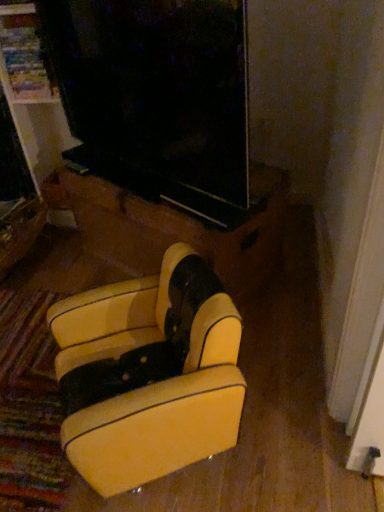
Question: Considering the relative sizes of yellow leather armchair at lower center, the 1th furniture viewed from the front, and wooden drawer at lower left in the image provided, is yellow leather armchair at lower center, the 1th furniture viewed from the front, taller than wooden drawer at lower left?

Choices:
 (A) yes
 (B) no

Answer: (A)

Question: Is yellow leather armchair at lower center, which ranks as the second furniture in back-to-front order, further to camera compared to wooden drawer at lower left?

Choices:
 (A) yes
 (B) no

Answer: (B)

Question: From the image's perspective, would you say yellow leather armchair at lower center, the 1th furniture viewed from the front, is shown under wooden drawer at lower left?

Choices:
 (A) no
 (B) yes

Answer: (B)

Question: Can you confirm if yellow leather armchair at lower center, the 1th furniture viewed from the front, is shorter than wooden drawer at lower left?

Choices:
 (A) yes
 (B) no

Answer: (B)

Question: From the image's perspective, does yellow leather armchair at lower center, the 1th furniture viewed from the front, appear higher than wooden drawer at lower left?

Choices:
 (A) yes
 (B) no

Answer: (B)

Question: From the image's perspective, is yellow leather armchair at lower center, the 1th furniture viewed from the front, positioned above or below leather armchair at center, which is the second furniture from front to back?

Choices:
 (A) above
 (B) below

Answer: (B)

Question: In terms of width, does yellow leather armchair at lower center, which ranks as the second furniture in back-to-front order, look wider or thinner when compared to leather armchair at center, which is the second furniture from front to back?

Choices:
 (A) thin
 (B) wide

Answer: (A)

Question: From a real-world perspective, is yellow leather armchair at lower center, which ranks as the second furniture in back-to-front order, above or below leather armchair at center, which is the first furniture in back-to-front order?

Choices:
 (A) above
 (B) below

Answer: (A)

Question: Is yellow leather armchair at lower center, which ranks as the second furniture in back-to-front order, inside or outside of leather armchair at center, which is the first furniture in back-to-front order?

Choices:
 (A) inside
 (B) outside

Answer: (B)

Question: From a real-world perspective, is leather armchair at center, which is the second furniture from front to back, positioned above or below yellow leather armchair at lower center, the 1th furniture viewed from the front?

Choices:
 (A) above
 (B) below

Answer: (B)

Question: Is leather armchair at center, which is the second furniture from front to back, in front of or behind yellow leather armchair at lower center, the 1th furniture viewed from the front, in the image?

Choices:
 (A) front
 (B) behind

Answer: (B)

Question: Is leather armchair at center, which is the second furniture from front to back, bigger or smaller than yellow leather armchair at lower center, which ranks as the second furniture in back-to-front order?

Choices:
 (A) small
 (B) big

Answer: (B)

Question: Is leather armchair at center, which is the second furniture from front to back, taller or shorter than yellow leather armchair at lower center, which ranks as the second furniture in back-to-front order?

Choices:
 (A) short
 (B) tall

Answer: (A)

Question: Considering the positions of wooden drawer at lower left and yellow leather armchair at lower center, which ranks as the second furniture in back-to-front order, in the image, is wooden drawer at lower left bigger or smaller than yellow leather armchair at lower center, which ranks as the second furniture in back-to-front order,?

Choices:
 (A) big
 (B) small

Answer: (B)

Question: Considering the positions of wooden drawer at lower left and yellow leather armchair at lower center, the 1th furniture viewed from the front, in the image, is wooden drawer at lower left taller or shorter than yellow leather armchair at lower center, the 1th furniture viewed from the front,?

Choices:
 (A) short
 (B) tall

Answer: (A)